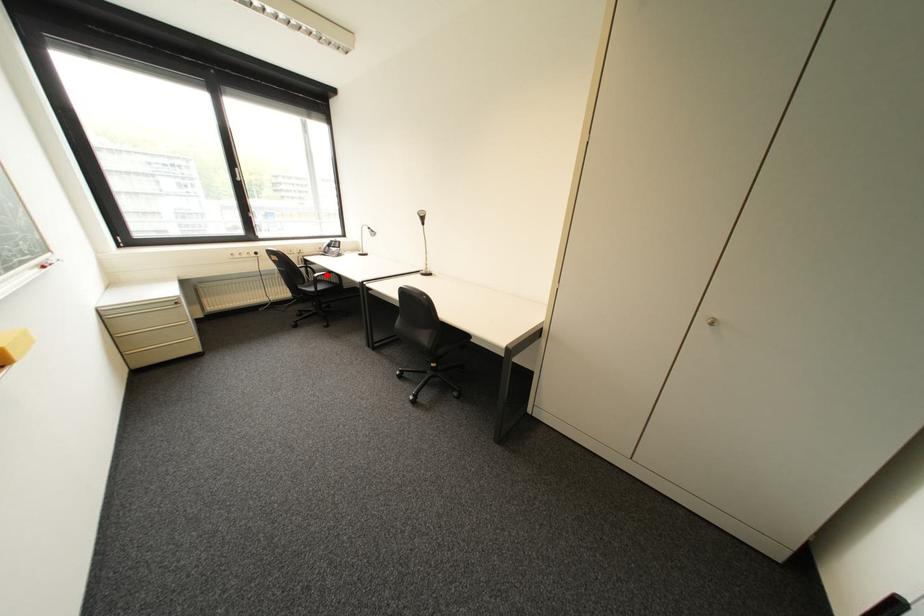
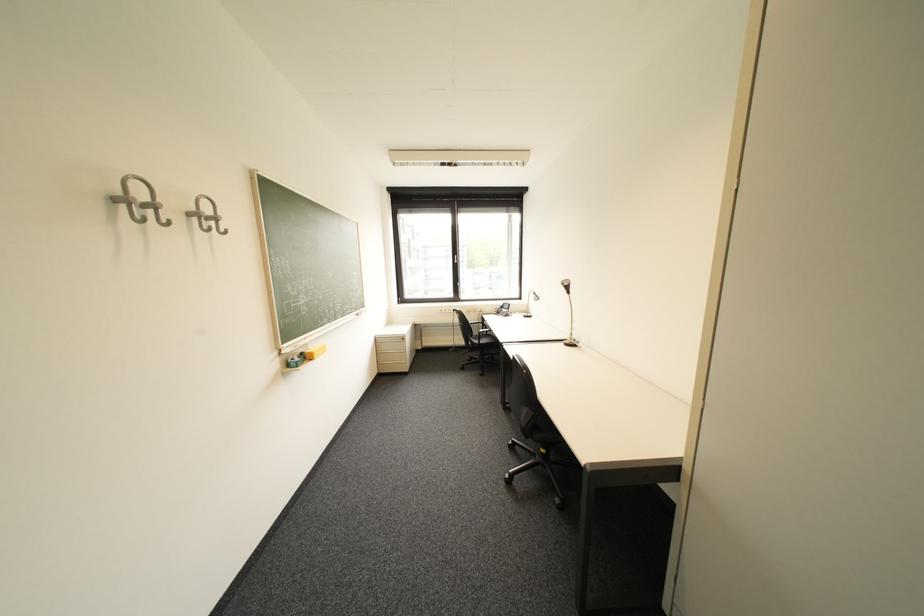
Question: A red point is marked in image1. In image2, is the corresponding 3D point closer to the camera or farther? Reply with the corresponding letter.

Choices:
 (A) The corresponding 3D point is closer.
 (B) The corresponding 3D point is farther.

Answer: (A)